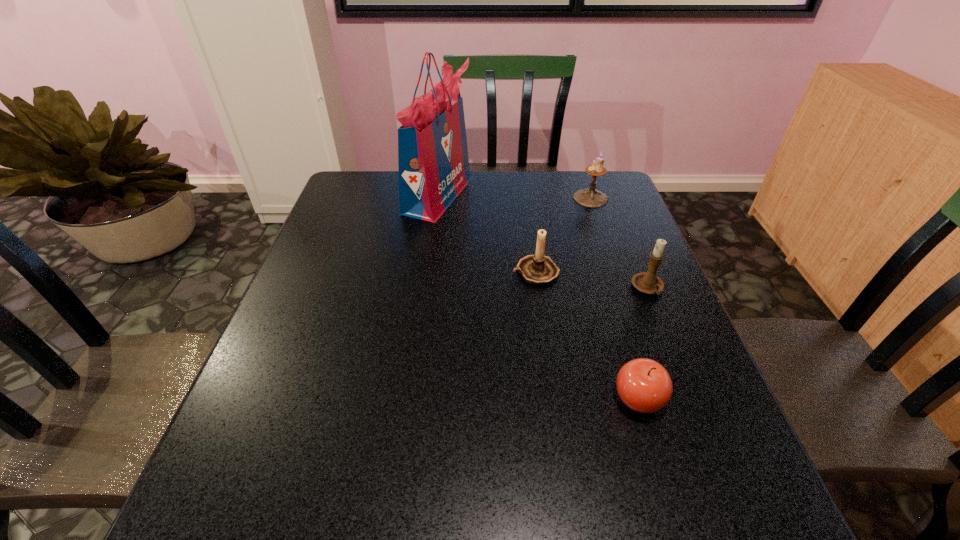
Locate an element on the screen. vacant space at the near right corner of the desktop is located at coordinates (780, 529).

Find the location of a particular element. This screenshot has height=540, width=960. vacant area that lies between the tallest object and the shortest object is located at coordinates (539, 297).

This screenshot has width=960, height=540. In order to click on blank region between the farthest candle holder and the nearest object in this screenshot , I will do `click(614, 299)`.

I want to click on vacant area that lies between the second object from left to right and the apple, so click(587, 335).

Find the location of a particular element. The width and height of the screenshot is (960, 540). free point between the farthest candle holder and the shortest object is located at coordinates (614, 299).

Where is `vacant space that is in between the grocery bag and the farthest candle holder`? This screenshot has height=540, width=960. vacant space that is in between the grocery bag and the farthest candle holder is located at coordinates (515, 197).

I want to click on blank region between the farthest candle holder and the shortest object, so click(614, 299).

Locate which object ranks fourth in proximity to the fourth object from right to left. Please provide its 2D coordinates. Your answer should be formatted as a tuple, i.e. [(x, y)], where the tuple contains the x and y coordinates of a point satisfying the conditions above.

[(644, 385)]

This screenshot has height=540, width=960. Identify the location of object that is the nearest to the farthest candle holder. (537, 269).

In order to click on candle holder that is the closest one to the farthest candle holder in this screenshot , I will do `click(537, 269)`.